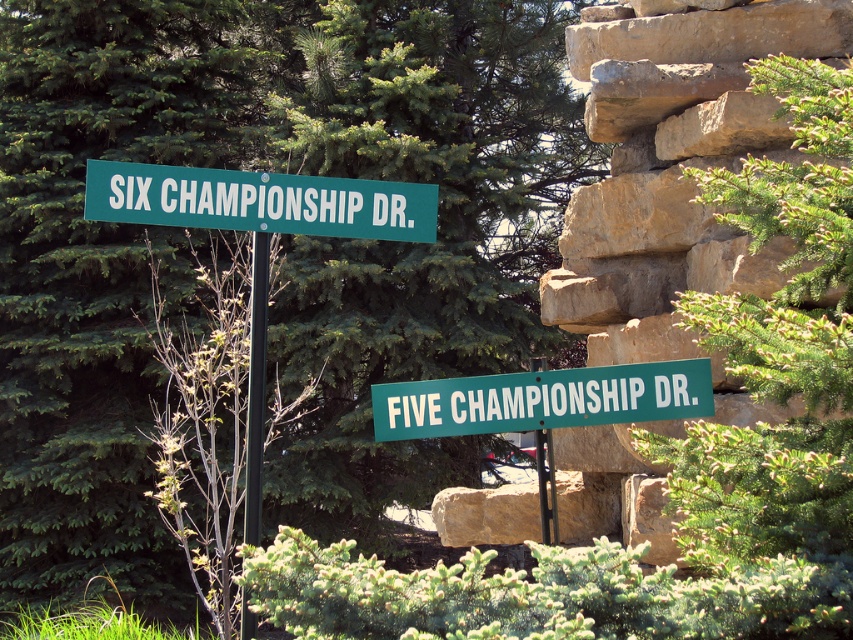
Is green plastic street sign at upper center above green plastic pole at center?

Indeed, green plastic street sign at upper center is positioned over green plastic pole at center.

Describe the element at coordinates (259, 202) in the screenshot. This screenshot has width=853, height=640. I see `green plastic street sign at upper center` at that location.

Measure the distance between green plastic street sign at upper center and camera.

The distance of green plastic street sign at upper center from camera is 13.91 feet.

At what (x,y) coordinates should I click in order to perform the action: click on green plastic street sign at upper center. Please return your answer as a coordinate pair (x, y). The height and width of the screenshot is (640, 853). Looking at the image, I should click on (259, 202).

Can you confirm if black metal pole at center is thinner than green plastic pole at center?

Yes.

Does black metal pole at center appear under green plastic pole at center?

No.

Which is in front, point (254, 230) or point (544, 481)?

Point (254, 230)

Where is `black metal pole at center`? black metal pole at center is located at coordinates (256, 387).

Measure the distance from green leafy tree at upper center to green plastic street sign at upper center.

A: The distance of green leafy tree at upper center from green plastic street sign at upper center is 8.07 meters.

Can you confirm if green leafy tree at upper center is positioned to the left of green plastic street sign at upper center?

Indeed, green leafy tree at upper center is positioned on the left side of green plastic street sign at upper center.

What do you see at coordinates (277, 252) in the screenshot?
I see `green leafy tree at upper center` at bounding box center [277, 252].

Locate an element on the screen. green leafy tree at upper center is located at coordinates (277, 252).